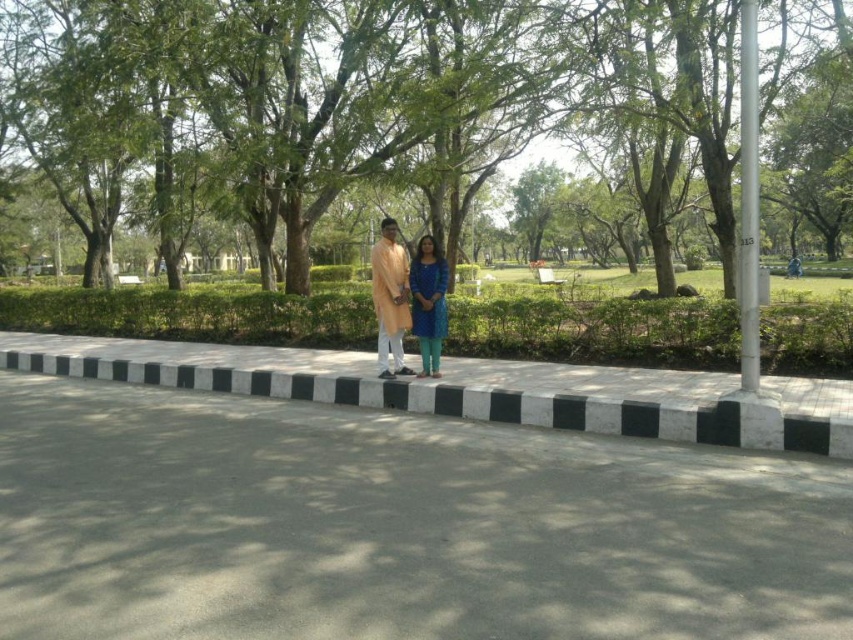
Question: Which point is farther to the camera?

Choices:
 (A) (405, 314)
 (B) (419, 260)
 (C) (171, 550)

Answer: (A)

Question: Estimate the real-world distances between objects in this image. Which object is farther from the teal fabric dress at center?

Choices:
 (A) black and white concrete curb at center
 (B) matte orange kurta at center

Answer: (A)

Question: Estimate the real-world distances between objects in this image. Which object is farther from the matte orange kurta at center?

Choices:
 (A) green leafy tree at center
 (B) white metallic pole at right

Answer: (A)

Question: Can you confirm if matte orange kurta at center is smaller than teal fabric dress at center?

Choices:
 (A) yes
 (B) no

Answer: (B)

Question: Considering the relative positions of green leafy tree at center and teal fabric dress at center in the image provided, where is green leafy tree at center located with respect to teal fabric dress at center?

Choices:
 (A) right
 (B) left

Answer: (B)

Question: From the image, what is the correct spatial relationship of gray asphalt pavement at center in relation to white metallic pole at right?

Choices:
 (A) left
 (B) right

Answer: (A)